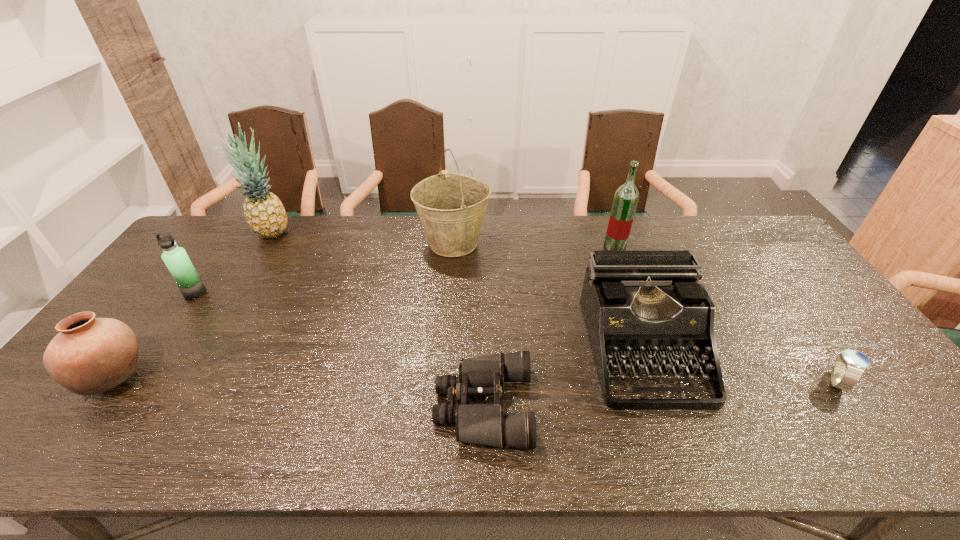
Image resolution: width=960 pixels, height=540 pixels. I want to click on liquor that is at the far edge, so click(x=626, y=197).

Locate an element on the screen. Image resolution: width=960 pixels, height=540 pixels. object at the near edge is located at coordinates (485, 424).

At what (x,y) coordinates should I click in order to perform the action: click on thermos bottle that is at the left edge. Please return your answer as a coordinate pair (x, y). Looking at the image, I should click on [176, 259].

Where is `pottery located at the left edge`? This screenshot has height=540, width=960. pottery located at the left edge is located at coordinates (90, 355).

Identify the location of object present at the right edge. (848, 367).

Locate an element on the screen. The height and width of the screenshot is (540, 960). vacant space at the far edge is located at coordinates (231, 248).

Find the location of `vacant space at the near edge`. vacant space at the near edge is located at coordinates (826, 433).

You are a GUI agent. You are given a task and a screenshot of the screen. Output one action in this format:
    pyautogui.click(x=<x>, y=<y>)
    Task: Click on the free space at the left edge of the desktop
    The image size is (960, 540).
    Given the screenshot: What is the action you would take?
    pyautogui.click(x=167, y=273)

The width and height of the screenshot is (960, 540). I want to click on vacant space at the right edge of the desktop, so click(x=803, y=332).

In the image, there is a desktop. At what (x,y) coordinates should I click in order to perform the action: click on vacant space at the near left corner. Please return your answer as a coordinate pair (x, y). Image resolution: width=960 pixels, height=540 pixels. Looking at the image, I should click on (49, 450).